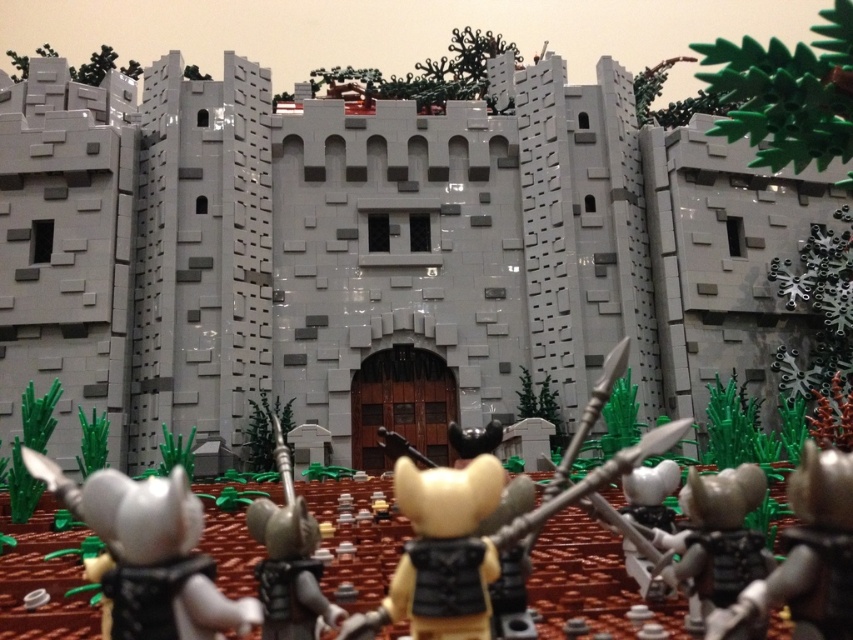
Describe the element at coordinates (151, 538) in the screenshot. This screenshot has height=640, width=853. I see `white matte axe at lower left` at that location.

Find the location of a particular element. The width and height of the screenshot is (853, 640). white matte axe at lower left is located at coordinates (151, 538).

Does white matte axe at lower left appear on the right side of metallic silver armor at lower right?

Incorrect, white matte axe at lower left is not on the right side of metallic silver armor at lower right.

Does white matte axe at lower left have a lesser height compared to metallic silver armor at lower right?

Indeed, white matte axe at lower left has a lesser height compared to metallic silver armor at lower right.

You are a GUI agent. You are given a task and a screenshot of the screen. Output one action in this format:
    pyautogui.click(x=<x>, y=<y>)
    Task: Click on the white matte axe at lower left
    The width and height of the screenshot is (853, 640).
    Given the screenshot: What is the action you would take?
    pyautogui.click(x=151, y=538)

Does metallic silver armor at lower right have a greater height compared to metallic silver spear at center?

Yes, metallic silver armor at lower right is taller than metallic silver spear at center.

Is point (851, 608) in front of point (276, 442)?

Yes, point (851, 608) is closer to viewer.

Where is `metallic silver armor at lower right`? This screenshot has height=640, width=853. metallic silver armor at lower right is located at coordinates (805, 556).